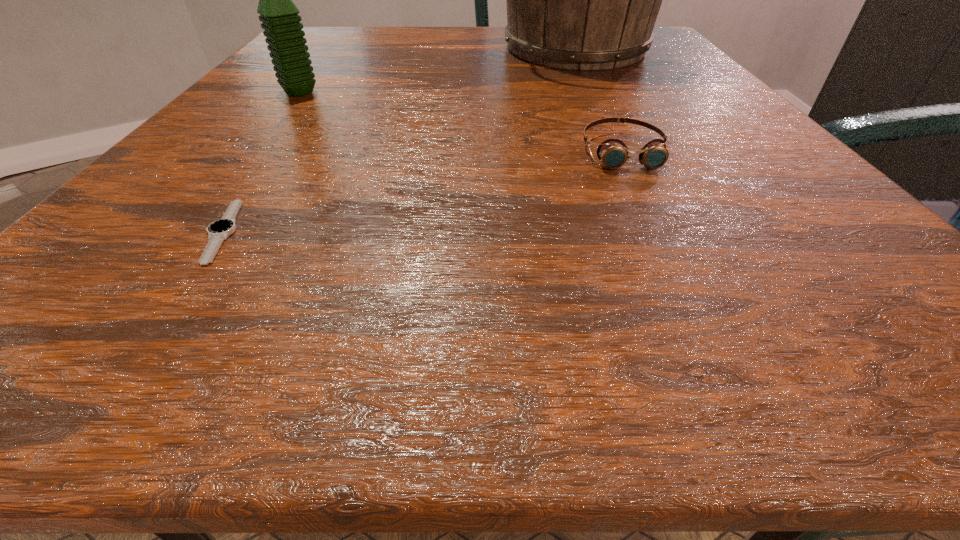
Identify the location of vacant area situated 0.140m through the lenses of the third tallest object. The height and width of the screenshot is (540, 960). (668, 243).

Locate an element on the screen. The height and width of the screenshot is (540, 960). vacant space located on the back of the shortest object is located at coordinates (281, 147).

Find the location of a particular element. This screenshot has width=960, height=540. object that is positioned at the far edge is located at coordinates click(587, 0).

The width and height of the screenshot is (960, 540). I want to click on water bottle that is at the left edge, so click(x=281, y=23).

I want to click on watch located at the left edge, so click(x=218, y=231).

This screenshot has height=540, width=960. Find the location of `bucket that is at the right edge`. bucket that is at the right edge is located at coordinates (587, 0).

This screenshot has width=960, height=540. I want to click on goggles situated at the right edge, so click(x=613, y=153).

Locate an element on the screen. This screenshot has height=540, width=960. object located in the far right corner section of the desktop is located at coordinates (587, 0).

The width and height of the screenshot is (960, 540). In order to click on vacant space at the far edge of the desktop in this screenshot , I will do `click(449, 46)`.

Identify the location of vacant space at the near edge of the desktop. This screenshot has height=540, width=960. (261, 316).